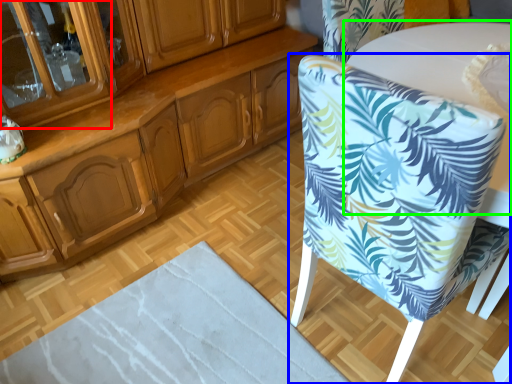
Question: Which object is positioned farthest from glass door (highlighted by a red box)? Select from chair (highlighted by a blue box) and round table (highlighted by a green box).

Choices:
 (A) chair
 (B) round table

Answer: (B)